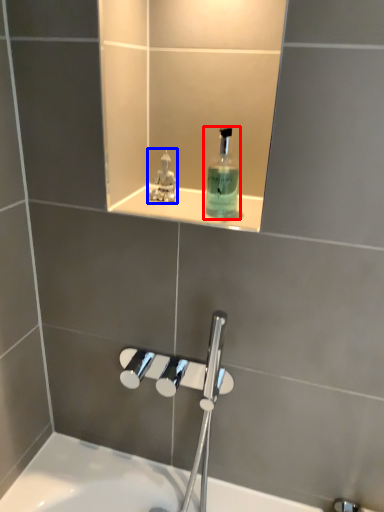
Question: Among these objects, which one is farthest to the camera, mouthwash (highlighted by a red box) or perfume (highlighted by a blue box)?

Choices:
 (A) mouthwash
 (B) perfume

Answer: (B)